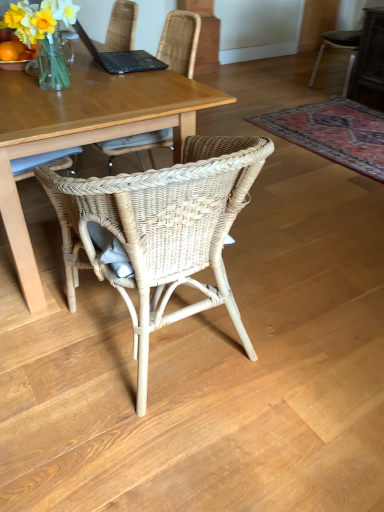
The height and width of the screenshot is (512, 384). Find the location of `free region under woven rattan chair at center, which is the first chair in left-to-right order (from a real-world perspective)`. free region under woven rattan chair at center, which is the first chair in left-to-right order (from a real-world perspective) is located at coordinates click(170, 341).